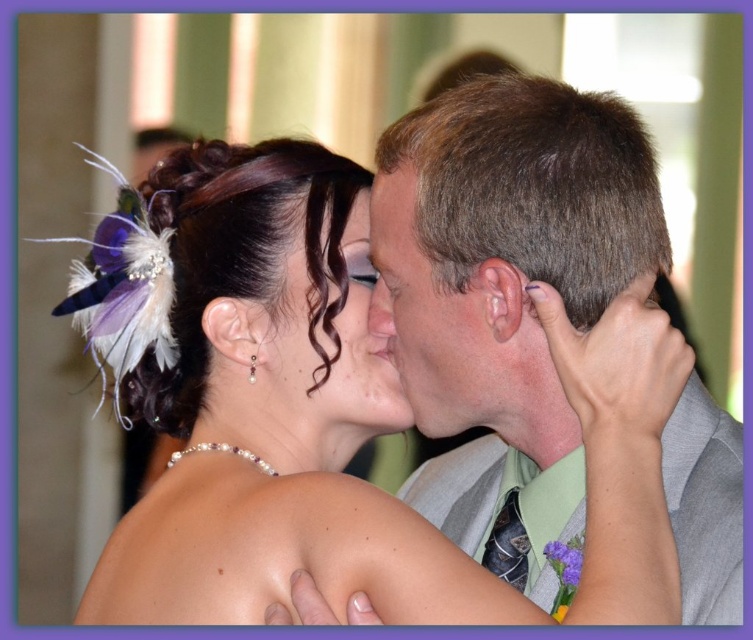
You are a photographer adjusting your camera settings to capture the details of the matte gray suit at center and the matte black hair at center. Based on their positions, which object is covering part of the other?

The matte gray suit at center is positioned over matte black hair at center, so it is covering part of the matte black hair at center.

You are a photographer adjusting the framing for a portrait. You need to ensure the pearl necklace at center and the smooth skin nose at center are both visible in the final shot. Based on their positions, which object should you prioritize keeping centered to maintain balance?

The smooth skin nose at center is positioned to the right of the pearl necklace at center. To maintain balance, prioritize keeping the smooth skin nose at center centered as it is closer to the frame center.